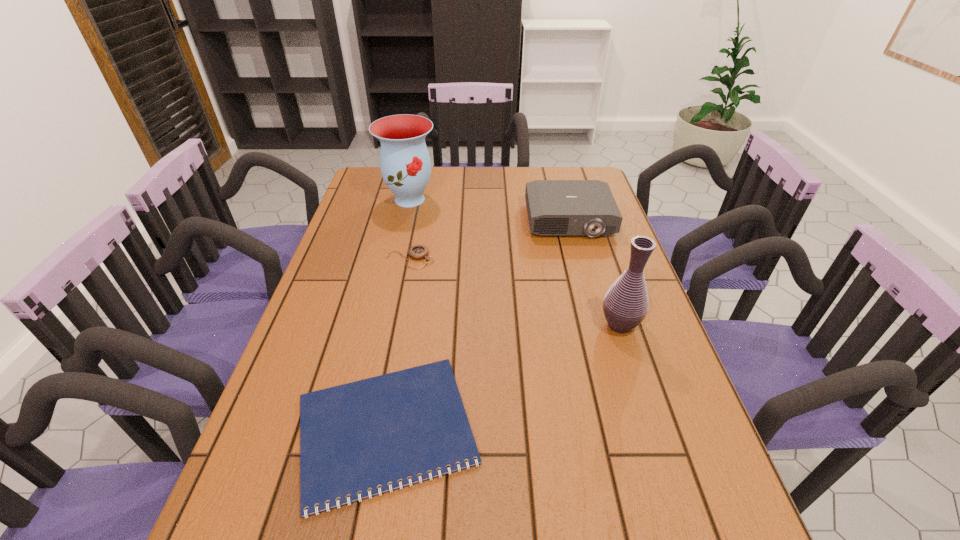
Identify the location of vacant space at the left edge of the desktop. (356, 275).

In the image, there is a desktop. What are the coordinates of `blank space at the right edge` in the screenshot? It's located at (641, 431).

The width and height of the screenshot is (960, 540). In the image, there is a desktop. Find the location of `vacant region at the far right corner`. vacant region at the far right corner is located at coordinates (597, 178).

Find the location of `unoccupied area between the left vase and the nearest object`. unoccupied area between the left vase and the nearest object is located at coordinates click(397, 314).

Image resolution: width=960 pixels, height=540 pixels. What are the coordinates of `blank region between the shortest object and the fourth tallest object` in the screenshot? It's located at (398, 344).

Where is `vacant space that's between the third tallest object and the notepad`? vacant space that's between the third tallest object and the notepad is located at coordinates (477, 325).

What are the coordinates of `vacant area between the pocket watch and the notepad` in the screenshot? It's located at (398, 344).

Locate an element on the screen. The image size is (960, 540). free point between the right vase and the third farthest object is located at coordinates (515, 292).

Locate an element on the screen. This screenshot has height=540, width=960. free spot between the projector and the farther vase is located at coordinates (490, 210).

Where is `empty space between the left vase and the shortest object`? empty space between the left vase and the shortest object is located at coordinates (397, 314).